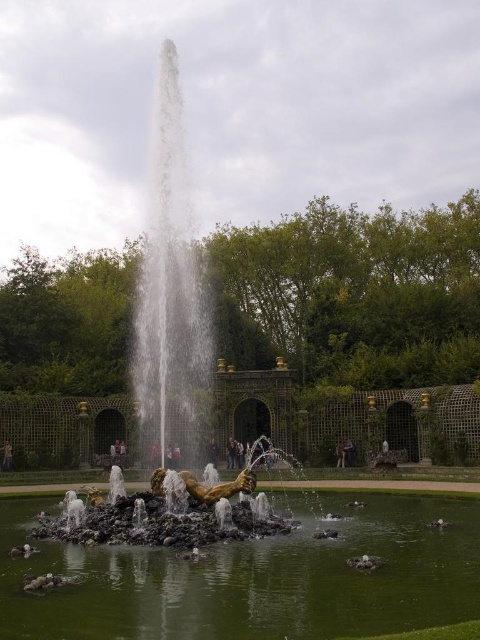
Measure the distance from gold metallic statue at center to golden statue at center.

gold metallic statue at center and golden statue at center are 121.40 feet apart from each other.

Between gold metallic statue at center and golden statue at center, which one appears on the right side from the viewer's perspective?

gold metallic statue at center

Who is more distant from viewer, (148, 384) or (11, 445)?

The point (148, 384) is more distant.

Identify the location of gold metallic statue at center. (169, 372).

How far apart are green polished stone water at center and gold metallic statue at center?

The distance of green polished stone water at center from gold metallic statue at center is 74.68 feet.

Is green polished stone water at center to the left of gold metallic statue at center from the viewer's perspective?

Incorrect, green polished stone water at center is not on the left side of gold metallic statue at center.

Find the location of a particular element. This screenshot has width=480, height=640. green polished stone water at center is located at coordinates (254, 577).

Which is more to the right, green polished stone water at center or golden statue at center?

green polished stone water at center

Find the location of a particular element. green polished stone water at center is located at coordinates (254, 577).

Measure the distance between green polished stone water at center and camera.

green polished stone water at center is 25.32 meters from camera.

This screenshot has width=480, height=640. Find the location of `green polished stone water at center`. green polished stone water at center is located at coordinates (254, 577).